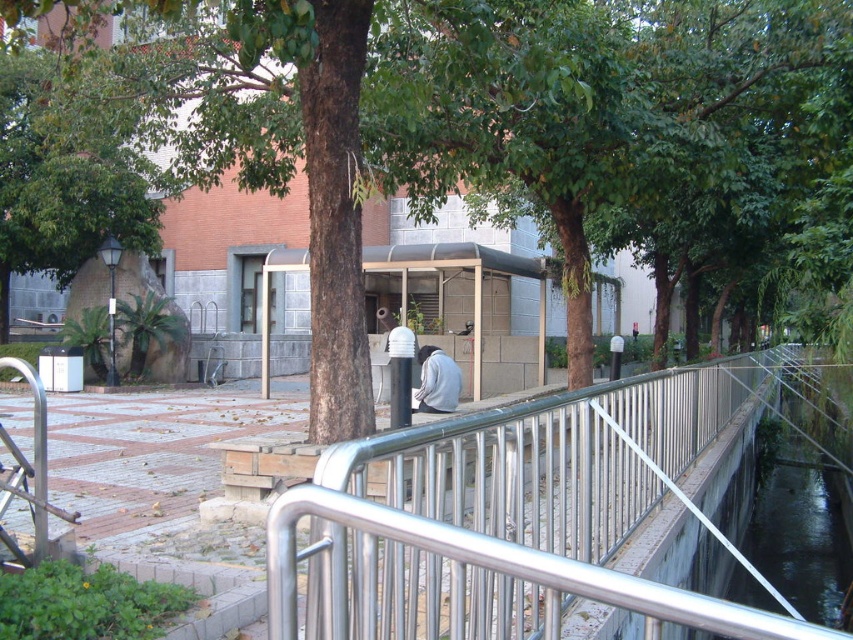
Question: From the image, what is the correct spatial relationship of brown textured tree at center in relation to clear glass waterway at center?

Choices:
 (A) above
 (B) below

Answer: (A)

Question: Does brown textured tree at center appear under clear glass waterway at center?

Choices:
 (A) yes
 (B) no

Answer: (B)

Question: Which point appears farthest from the camera in this image?

Choices:
 (A) (450, 620)
 (B) (323, 54)
 (C) (746, 552)

Answer: (C)

Question: Is brown textured tree at center wider than silver metallic railing at center?

Choices:
 (A) no
 (B) yes

Answer: (B)

Question: Which point is farther to the camera?

Choices:
 (A) (694, 572)
 (B) (663, 285)
 (C) (602, 502)

Answer: (B)

Question: Which object appears farthest from the camera in this image?

Choices:
 (A) silver metallic railing at center
 (B) clear glass waterway at center
 (C) brown textured tree at center

Answer: (C)